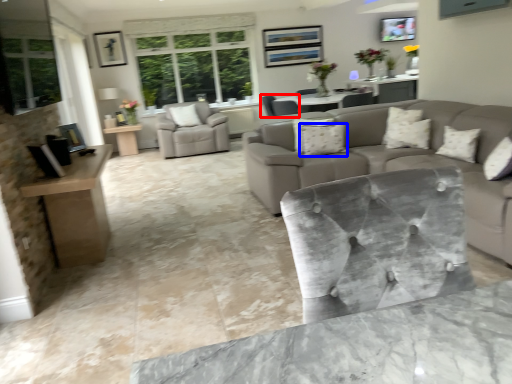
Question: Which of the following is the farthest to the observer, chair (highlighted by a red box) or pillow (highlighted by a blue box)?

Choices:
 (A) chair
 (B) pillow

Answer: (A)